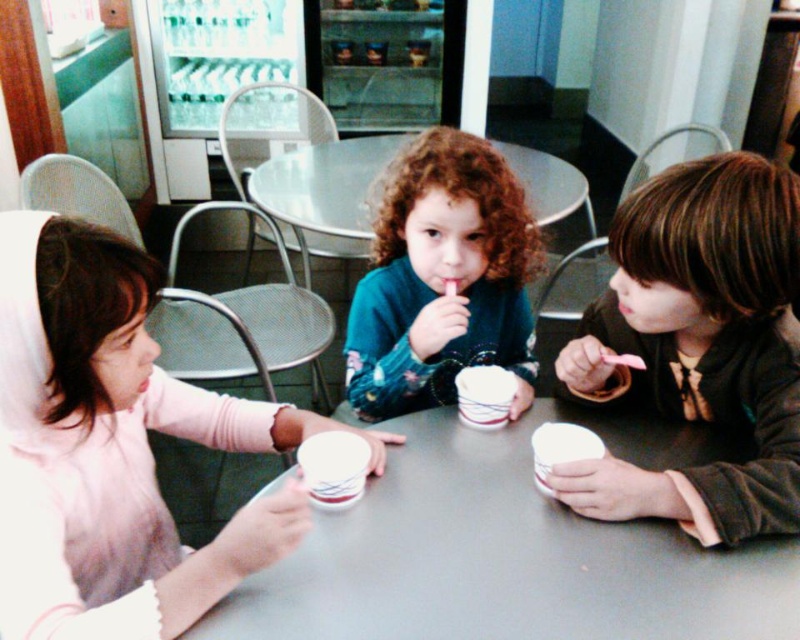
You are a parent trying to decide which item to take first from the table. You see the pink matte cupcake at center and the brown matte jacket at right. Which item is taller?

The brown matte jacket at right is taller than the pink matte cupcake at center.

You are a photographer trying to capture a group photo of the children. You notice the brown matte jacket at right and the teal floral sweater at center. Which child should you ask to move closer to ensure both are clearly visible in the photo?

Since the brown matte jacket at right is larger in size than the teal floral sweater at center, you should ask the child wearing the brown matte jacket at right to move closer to ensure both are clearly visible in the photo.

You are standing at the entrance of the cafe and see two points in the image, point (721, 336) and point (513, 410). Which point is closer to you?

Point (721, 336) is in front of point (513, 410), so it is closer to you.